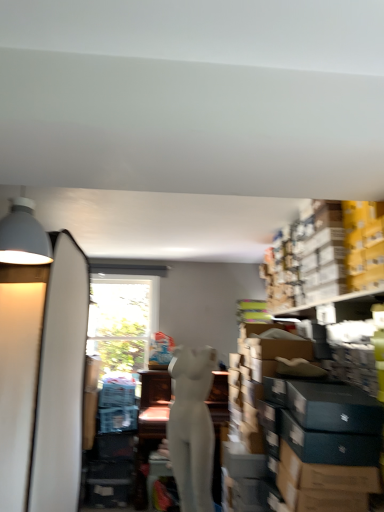
Question: From a real-world perspective, is yellow cardboard boxes at upper right positioned under matte gray lampshade at upper left based on gravity?

Choices:
 (A) no
 (B) yes

Answer: (B)

Question: Considering the relative sizes of yellow cardboard boxes at upper right and matte gray lampshade at upper left in the image provided, is yellow cardboard boxes at upper right smaller than matte gray lampshade at upper left?

Choices:
 (A) no
 (B) yes

Answer: (A)

Question: Is the position of yellow cardboard boxes at upper right more distant than that of matte gray lampshade at upper left?

Choices:
 (A) yes
 (B) no

Answer: (A)

Question: Is yellow cardboard boxes at upper right aimed at matte gray lampshade at upper left?

Choices:
 (A) no
 (B) yes

Answer: (B)

Question: Would you say yellow cardboard boxes at upper right is a long distance from matte gray lampshade at upper left?

Choices:
 (A) no
 (B) yes

Answer: (B)

Question: Is yellow cardboard boxes at upper right wider than matte gray lampshade at upper left?

Choices:
 (A) no
 (B) yes

Answer: (B)

Question: Is matte gray lampshade at upper left positioned in front of yellow cardboard boxes at upper right?

Choices:
 (A) yes
 (B) no

Answer: (A)

Question: Does matte gray lampshade at upper left turn towards yellow cardboard boxes at upper right?

Choices:
 (A) no
 (B) yes

Answer: (A)

Question: Considering the relative sizes of matte gray lampshade at upper left and yellow cardboard boxes at upper right in the image provided, is matte gray lampshade at upper left taller than yellow cardboard boxes at upper right?

Choices:
 (A) no
 (B) yes

Answer: (A)

Question: Is the position of matte gray lampshade at upper left more distant than that of yellow cardboard boxes at upper right?

Choices:
 (A) yes
 (B) no

Answer: (B)

Question: Is matte gray lampshade at upper left next to yellow cardboard boxes at upper right?

Choices:
 (A) no
 (B) yes

Answer: (A)

Question: From a real-world perspective, is matte gray lampshade at upper left positioned over yellow cardboard boxes at upper right based on gravity?

Choices:
 (A) no
 (B) yes

Answer: (B)

Question: Is yellow cardboard boxes at upper right further to the viewer compared to white matte mannequin at center?

Choices:
 (A) no
 (B) yes

Answer: (A)